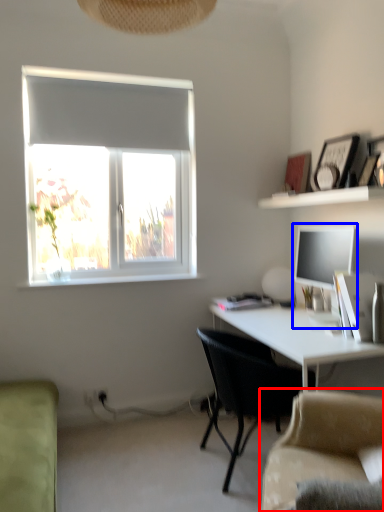
Question: Among these objects, which one is farthest to the camera, studio couch (highlighted by a red box) or desktop computer (highlighted by a blue box)?

Choices:
 (A) studio couch
 (B) desktop computer

Answer: (B)